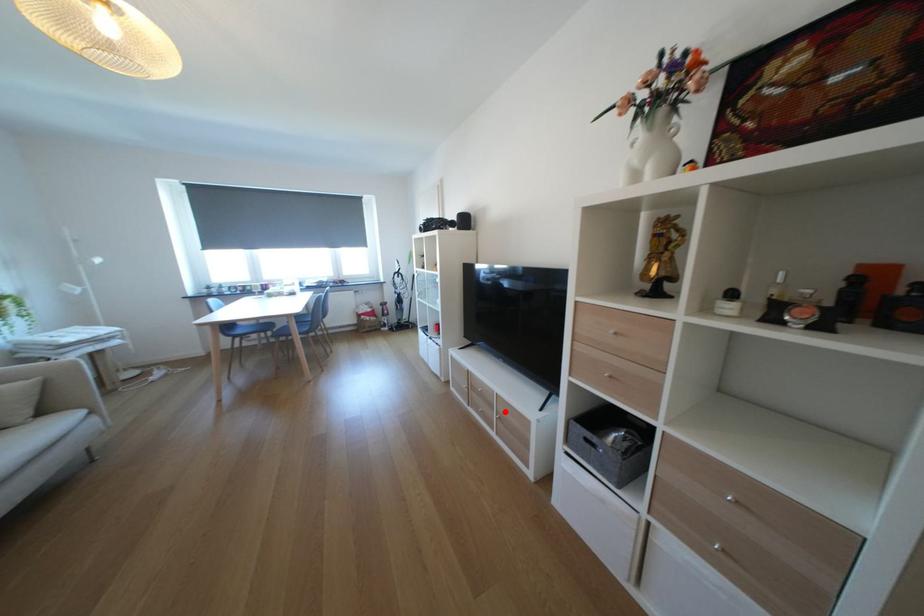
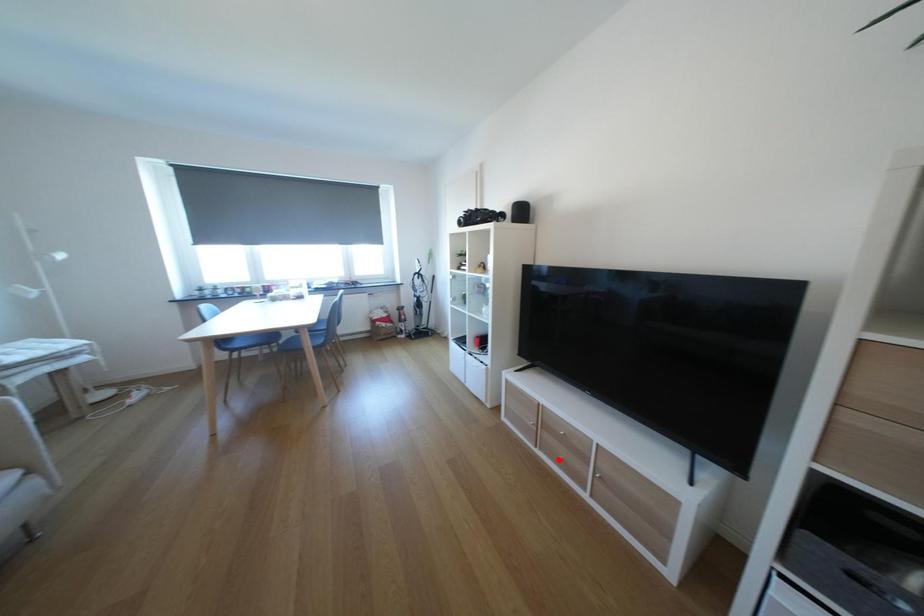
I am providing you with two images of the same scene from different viewpoints. A red point is marked on the first image and another point is marked on the second image. Do the highlighted points in image1 and image2 indicate the same real-world spot?

No